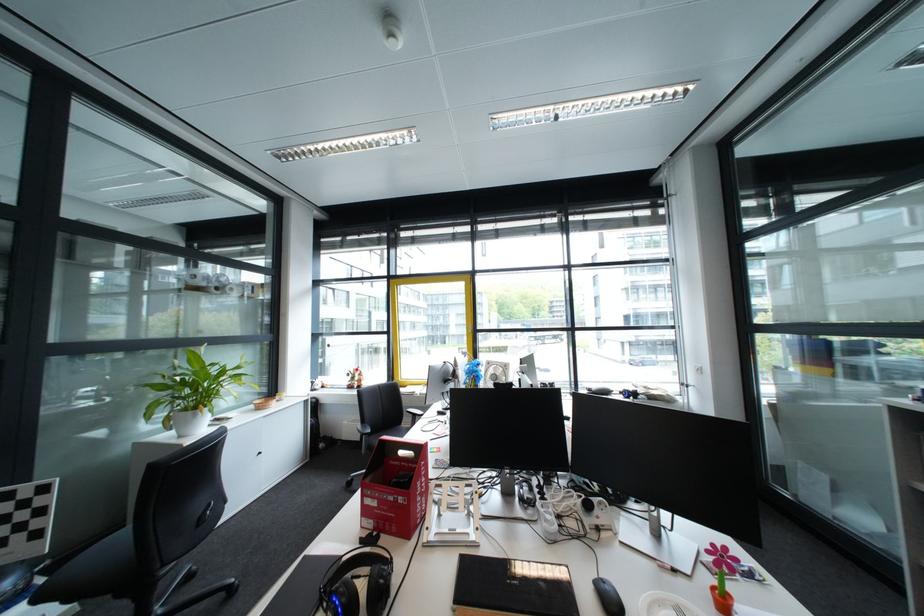
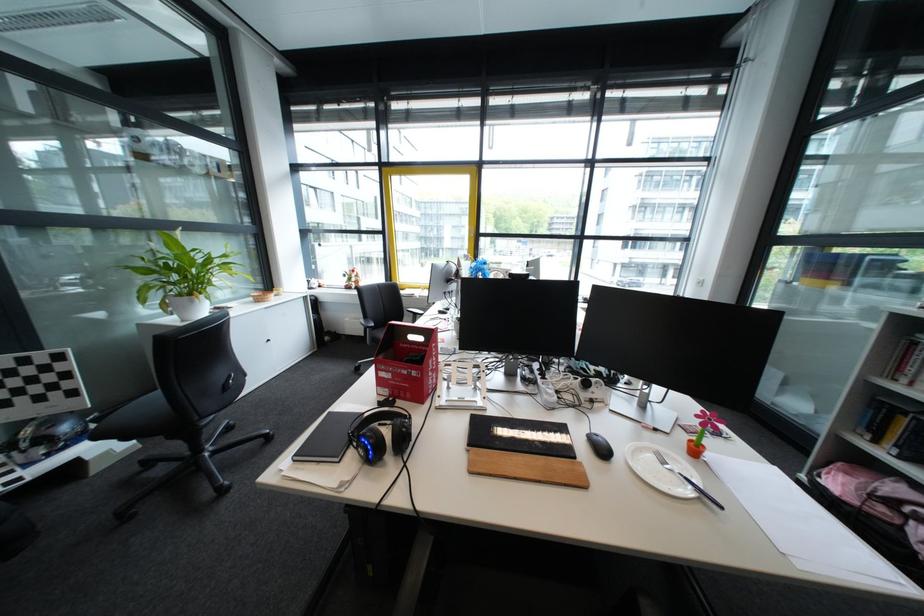
Question: The first image is from the beginning of the video and the second image is from the end. How did the camera likely rotate when shooting the video?

Choices:
 (A) Left
 (B) Right
 (C) Up
 (D) Down

Answer: (D)